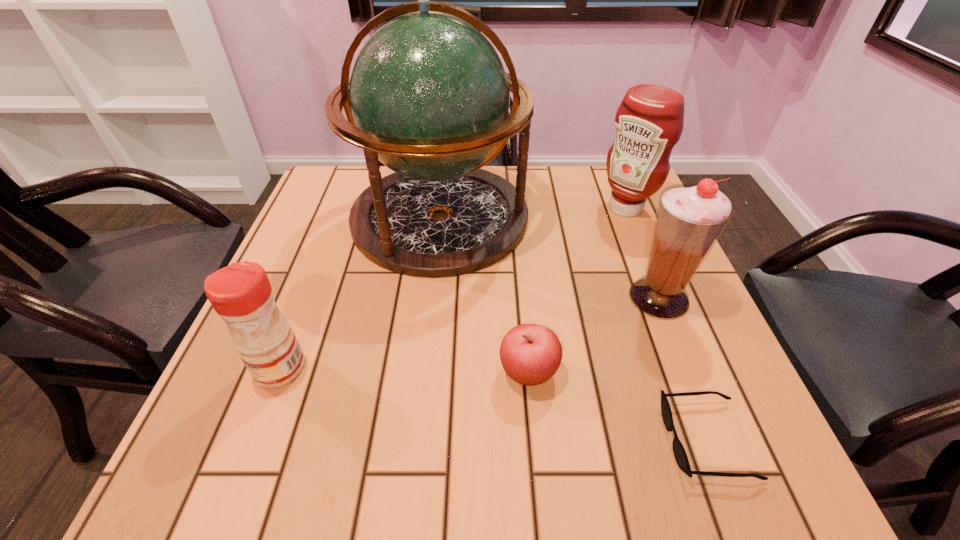
Identify the location of free space in the image that satisfies the following two spatial constraints: 1. on the front side of the right condiment; 2. on the front-facing side of the nearest object. The width and height of the screenshot is (960, 540). (720, 440).